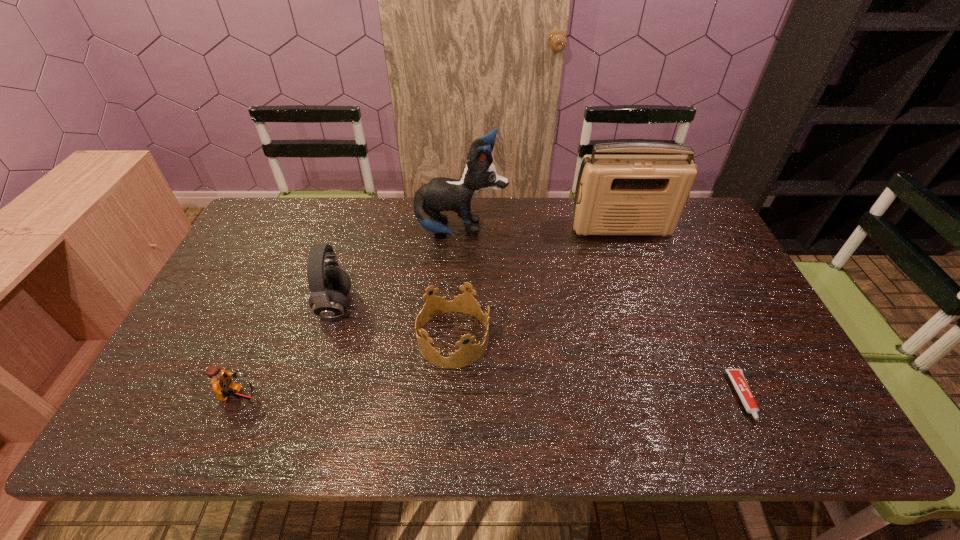
At what (x,y) coordinates should I click in order to perform the action: click on puppy. Please return your answer as a coordinate pair (x, y). The width and height of the screenshot is (960, 540). Looking at the image, I should click on click(440, 194).

The width and height of the screenshot is (960, 540). I want to click on radio receiver, so click(615, 194).

At what (x,y) coordinates should I click in order to perform the action: click on the fifth object from right to left. Please return your answer as a coordinate pair (x, y). This screenshot has width=960, height=540. Looking at the image, I should click on (329, 284).

In order to click on headset in this screenshot , I will do `click(329, 284)`.

The image size is (960, 540). In order to click on tiara in this screenshot , I will do `click(468, 353)`.

Find the location of a particular element. This screenshot has width=960, height=540. the leftmost object is located at coordinates (221, 382).

Find the location of a particular element. The height and width of the screenshot is (540, 960). the shortest object is located at coordinates (737, 377).

Image resolution: width=960 pixels, height=540 pixels. Identify the location of vacant space located on the front-facing side of the puppy. (540, 231).

Find the location of a particular element. vacant space located on the front-facing side of the radio receiver is located at coordinates (649, 306).

This screenshot has height=540, width=960. I want to click on vacant region located 0.150m on the ear cups of the headset, so click(x=408, y=306).